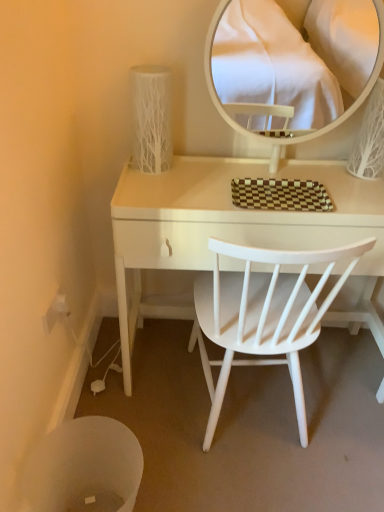
This screenshot has width=384, height=512. What do you see at coordinates (84, 468) in the screenshot? I see `white plastic trash bin at lower left` at bounding box center [84, 468].

Measure the distance between point (119, 434) and camera.

Point (119, 434) and camera are 3.85 feet apart from each other.

This screenshot has height=512, width=384. What do you see at coordinates (263, 315) in the screenshot? I see `white wood chair at center` at bounding box center [263, 315].

Where is `white wood desk at center`? white wood desk at center is located at coordinates (233, 232).

Describe the element at coordinates (295, 56) in the screenshot. I see `white glossy mirror at upper center` at that location.

Find the location of a particular element. This screenshot has width=384, height=512. white glossy mirror at upper center is located at coordinates (295, 56).

The image size is (384, 512). Describe the element at coordinates (280, 195) in the screenshot. I see `brown checkered tray at center` at that location.

What are the coordinates of `white plastic power outlet at lower left` in the screenshot? It's located at (55, 312).

Locate an element on the screen. white textured vase at upper left is located at coordinates (151, 118).

Considering the relative positions of white wood desk at center and white plastic trash bin at lower left in the image provided, is white wood desk at center to the left of white plastic trash bin at lower left from the viewer's perspective?

Incorrect, white wood desk at center is not on the left side of white plastic trash bin at lower left.

Is white wood desk at center far from white plastic trash bin at lower left?

No, white wood desk at center is in close proximity to white plastic trash bin at lower left.

From a real-world perspective, is white wood desk at center positioned above or below white plastic trash bin at lower left?

white wood desk at center is situated higher than white plastic trash bin at lower left in the real world.

Does white wood desk at center come in front of white plastic trash bin at lower left?

No, it is behind white plastic trash bin at lower left.

How many degrees apart are the facing directions of white wood chair at center and white plastic trash bin at lower left?

The facing directions of white wood chair at center and white plastic trash bin at lower left are 90 degrees apart.

Could you tell me if white wood chair at center is turned towards white plastic trash bin at lower left?

No, white wood chair at center is not oriented towards white plastic trash bin at lower left.

Which is correct: white wood chair at center is inside white plastic trash bin at lower left, or outside of it?

white wood chair at center lies outside white plastic trash bin at lower left.

In the image, is white plastic trash bin at lower left positioned in front of or behind white wood desk at center?

Clearly, white plastic trash bin at lower left is in front of white wood desk at center.

Are white plastic trash bin at lower left and white wood desk at center located far from each other?

white plastic trash bin at lower left is actually quite close to white wood desk at center.

You are a GUI agent. You are given a task and a screenshot of the screen. Output one action in this format:
    pyautogui.click(x=<x>, y=<y>)
    Task: Click on the trash bin/can that appears in front of the white wood desk at center
    The height and width of the screenshot is (512, 384).
    Given the screenshot: What is the action you would take?
    coord(84,468)

From a real-world perspective, which is physically above, brown checkered tray at center or white wood desk at center?

brown checkered tray at center.

From the image's perspective, is brown checkered tray at center on white wood desk at center?

Correct, brown checkered tray at center appears higher than white wood desk at center in the image.

Would you say brown checkered tray at center is outside white wood desk at center?

Actually, brown checkered tray at center is within white wood desk at center.

Can you confirm if brown checkered tray at center is taller than white wood desk at center?

No.

Is white wood chair at center to the left or to the right of white textured vase at upper left in the image?

Based on their positions, white wood chair at center is located to the right of white textured vase at upper left.

Which of these two, white wood chair at center or white textured vase at upper left, is thinner?

With smaller width is white textured vase at upper left.

Is white wood chair at center located outside white textured vase at upper left?

Yes, white wood chair at center is located beyond the bounds of white textured vase at upper left.

Is point (44, 322) positioned in front of point (205, 327)?

Yes.

From a real-world perspective, does white plastic power outlet at lower left stand above white wood chair at center?

Yes, from a real-world perspective, white plastic power outlet at lower left is on top of white wood chair at center.

Which object is closer to the camera taking this photo, white plastic power outlet at lower left or white wood chair at center?

white wood chair at center is more forward.

Is white plastic power outlet at lower left looking in the opposite direction of white wood chair at center?

white plastic power outlet at lower left is not turned away from white wood chair at center.

Is white glossy mirror at upper center aimed at white wood chair at center?

No, white glossy mirror at upper center does not turn towards white wood chair at center.

Where is `mirror behind the white wood chair at center`? Image resolution: width=384 pixels, height=512 pixels. mirror behind the white wood chair at center is located at coordinates (295, 56).

Can you tell me how much white glossy mirror at upper center and white wood chair at center differ in facing direction?

The angular difference between white glossy mirror at upper center and white wood chair at center is 179 degrees.

The height and width of the screenshot is (512, 384). In order to click on desk above the white plastic trash bin at lower left (from a real-world perspective) in this screenshot , I will do `click(233, 232)`.

You are a GUI agent. You are given a task and a screenshot of the screen. Output one action in this format:
    pyautogui.click(x=<x>, y=<y>)
    Task: Click on the trash bin/can behind the white wood chair at center
    Image resolution: width=384 pixels, height=512 pixels.
    Given the screenshot: What is the action you would take?
    pyautogui.click(x=84, y=468)

Which object lies further to the anchor point white plastic power outlet at lower left, white plastic trash bin at lower left or white wood desk at center?

white wood desk at center lies further to white plastic power outlet at lower left than the other object.

Based on their spatial positions, is white wood chair at center or white plastic trash bin at lower left further from white textured vase at upper left?

white plastic trash bin at lower left is further to white textured vase at upper left.

From the image, which object appears to be farther from white textured vase at upper left, white plastic trash bin at lower left or white plastic power outlet at lower left?

white plastic trash bin at lower left is positioned further to the anchor white textured vase at upper left.

Looking at the image, which one is located further to white plastic trash bin at lower left, white textured vase at upper left or white glossy mirror at upper center?

The object further to white plastic trash bin at lower left is white glossy mirror at upper center.

Based on the photo, from the image, which object appears to be nearer to white textured vase at upper left, white plastic power outlet at lower left or white wood chair at center?

white wood chair at center.

Which object lies nearer to the anchor point white wood chair at center, white wood desk at center or white plastic trash bin at lower left?

Among the two, white wood desk at center is located nearer to white wood chair at center.

Looking at this image, looking at the image, which one is located further to brown checkered tray at center, white wood chair at center or white glossy mirror at upper center?

white glossy mirror at upper center is positioned further to the anchor brown checkered tray at center.

Estimate the real-world distances between objects in this image. Which object is further from white wood chair at center, white textured vase at upper left or white plastic power outlet at lower left?

white plastic power outlet at lower left is further to white wood chair at center.

This screenshot has width=384, height=512. Find the location of `power outlet between brown checkered tray at center and white plastic trash bin at lower left in the up-down direction`. power outlet between brown checkered tray at center and white plastic trash bin at lower left in the up-down direction is located at coordinates (55, 312).

The height and width of the screenshot is (512, 384). Identify the location of mat between white plastic power outlet at lower left and white glossy mirror at upper center. (280, 195).

Where is `desk between brown checkered tray at center and white plastic trash bin at lower left in the vertical direction`? This screenshot has width=384, height=512. desk between brown checkered tray at center and white plastic trash bin at lower left in the vertical direction is located at coordinates (233, 232).

Locate an element on the screen. Image resolution: width=384 pixels, height=512 pixels. chair between white glossy mirror at upper center and white plastic trash bin at lower left in the vertical direction is located at coordinates (263, 315).